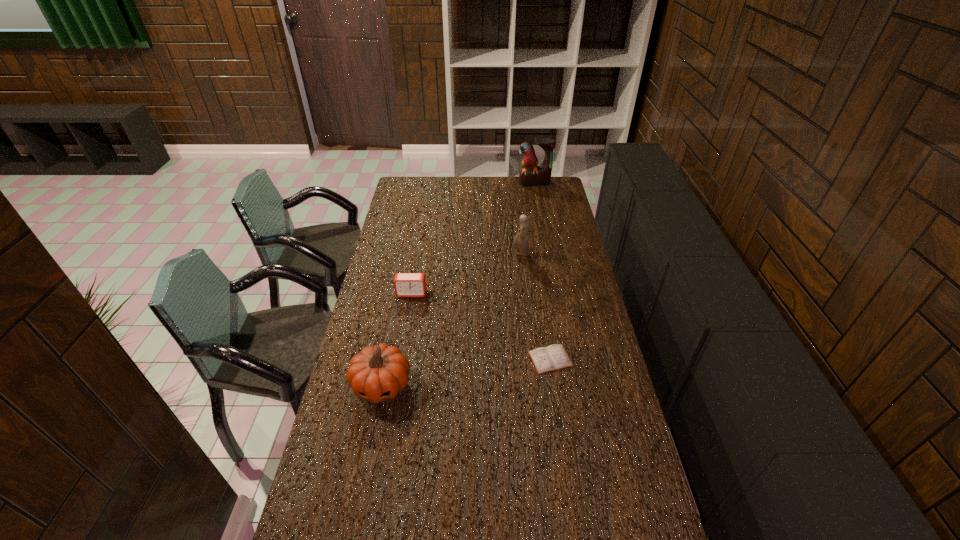
Where is `vacant space that satisfies the following two spatial constraints: 1. at the face of the parrot; 2. on the front-facing side of the fourth shortest object`? vacant space that satisfies the following two spatial constraints: 1. at the face of the parrot; 2. on the front-facing side of the fourth shortest object is located at coordinates (548, 253).

Where is `free space that satisfies the following two spatial constraints: 1. on the front-facing side of the shortest object; 2. on the left side of the figurine`? The width and height of the screenshot is (960, 540). free space that satisfies the following two spatial constraints: 1. on the front-facing side of the shortest object; 2. on the left side of the figurine is located at coordinates (532, 359).

The width and height of the screenshot is (960, 540). I want to click on free location that satisfies the following two spatial constraints: 1. on the front-facing side of the figurine; 2. on the front-facing side of the third nearest object, so click(524, 293).

In order to click on vacant area that satisfies the following two spatial constraints: 1. on the front-facing side of the alarm clock; 2. on the left side of the diary in this screenshot , I will do `click(400, 359)`.